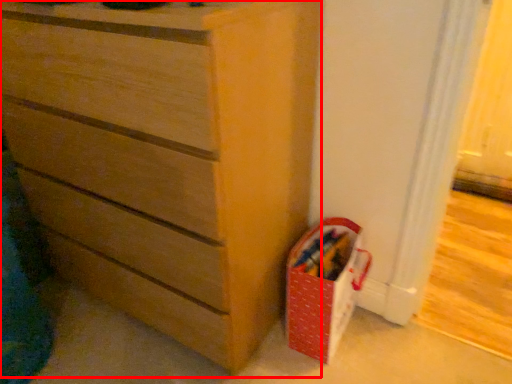
Question: From the image's perspective, where is chest of drawers (annotated by the red box) located in relation to kit in the image?

Choices:
 (A) above
 (B) below

Answer: (A)